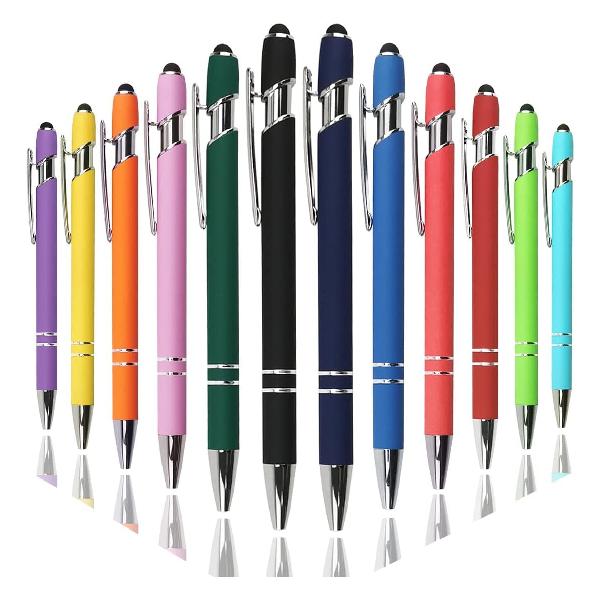
Where is `pens on left side`? The height and width of the screenshot is (600, 600). pens on left side is located at coordinates (46, 280), (84, 285), (124, 288), (174, 289), (223, 291), (277, 291).